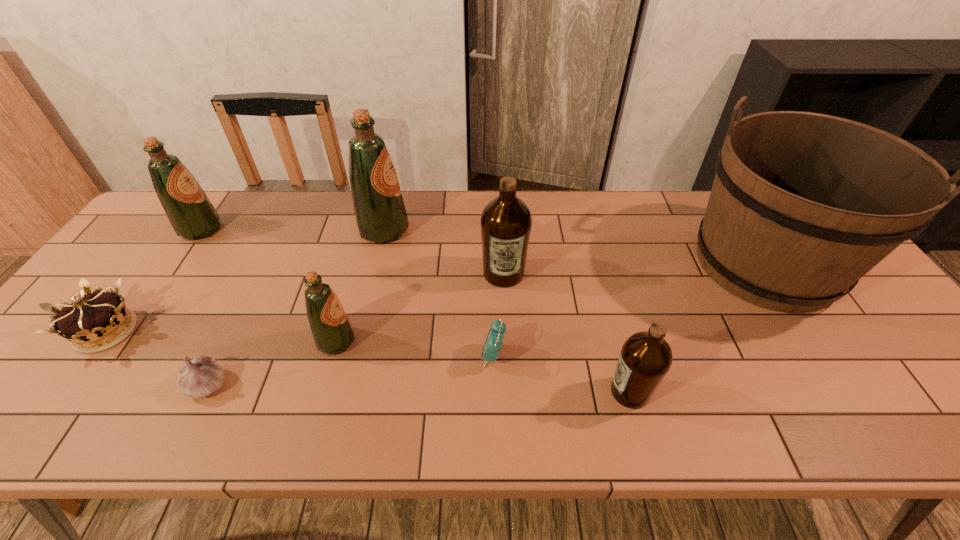
Find the location of `free space between the right brown olive oil and the gold crown`. free space between the right brown olive oil and the gold crown is located at coordinates (368, 361).

Where is `vacant area that lies between the fourth olive oil from left to right and the tallest olive oil`? Image resolution: width=960 pixels, height=540 pixels. vacant area that lies between the fourth olive oil from left to right and the tallest olive oil is located at coordinates click(x=444, y=252).

At what (x,y) coordinates should I click in order to perform the action: click on empty space that is in between the third object from left to right and the alarm clock. Please return your answer as a coordinate pair (x, y). This screenshot has width=960, height=540. Looking at the image, I should click on pyautogui.click(x=350, y=370).

Where is `vacant area that lies between the farther brown olive oil and the nearest green olive oil`? The height and width of the screenshot is (540, 960). vacant area that lies between the farther brown olive oil and the nearest green olive oil is located at coordinates (420, 307).

Find the location of `free area in between the bucket and the smallest green olive oil`. free area in between the bucket and the smallest green olive oil is located at coordinates (550, 302).

Locate an element on the screen. The height and width of the screenshot is (540, 960). free space between the crown and the third object from left to right is located at coordinates (156, 357).

Locate an element on the screen. The image size is (960, 540). blank region between the alarm clock and the fourth farthest olive oil is located at coordinates (415, 349).

Find the location of a particular element. vacant space that is in between the second smallest green olive oil and the alarm clock is located at coordinates (348, 293).

The image size is (960, 540). In order to click on vacant area that lies between the second olive oil from right to left and the biggest green olive oil in this screenshot , I will do `click(444, 252)`.

Locate an element on the screen. This screenshot has width=960, height=540. unoccupied position between the nearer brown olive oil and the bucket is located at coordinates (697, 328).